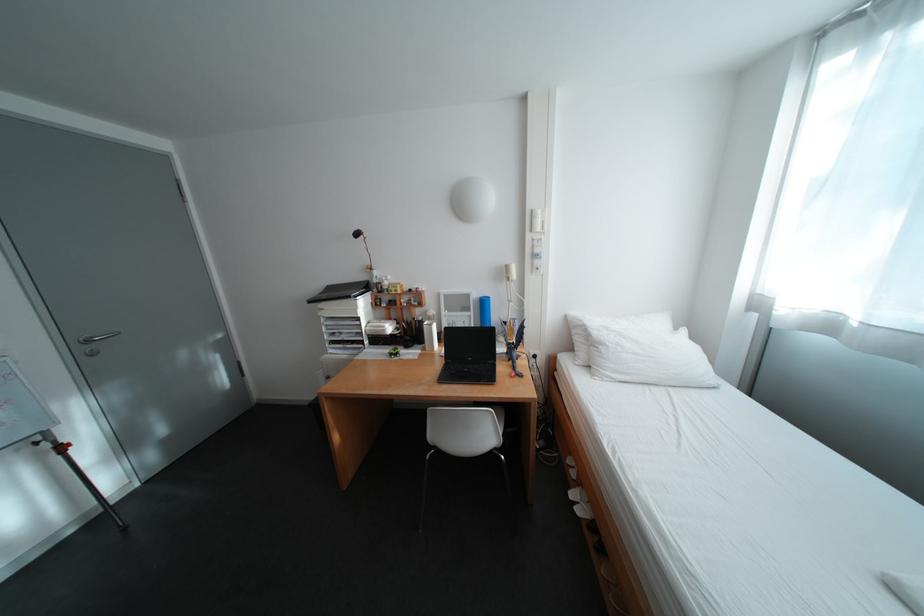
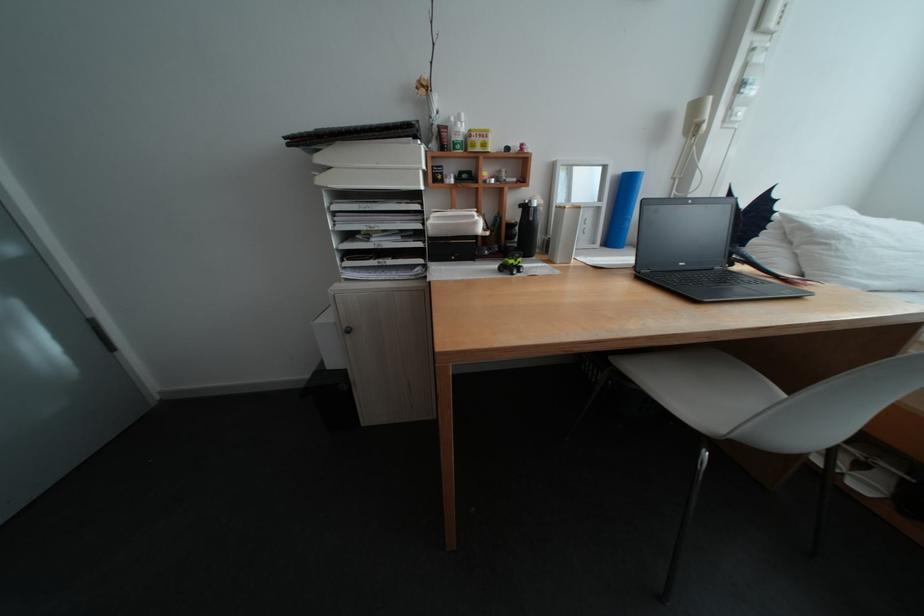
Locate, in the second image, the point that corresponds to [402,355] in the first image.

(511, 272)